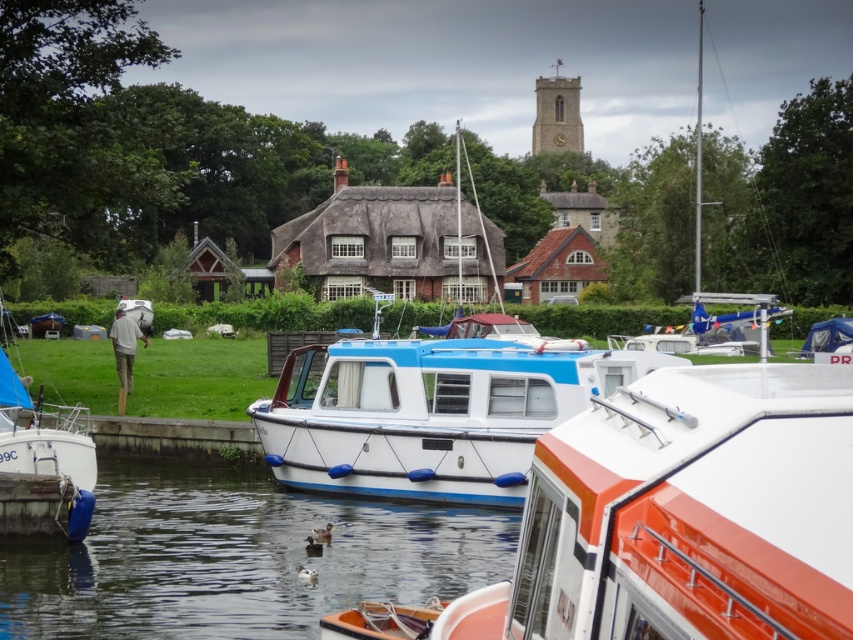
You are standing at the riverside and want to board the closest boat to you. Which boat should you choose between the white plastic boat at center and the blue matte boat at center?

The white plastic boat at center is closer to the viewer, so you should choose the white plastic boat at center to board.

You are standing at the camera position and want to find the white plastic boat at center. According to the scene description, where would you look in terms of direction and distance relative to the camera?

The white plastic boat at center is located at the 2D coordinates point (238, 557), which corresponds to the center area of the image. Since it is at the center, you should look straight ahead and it will be in the middle of your view.